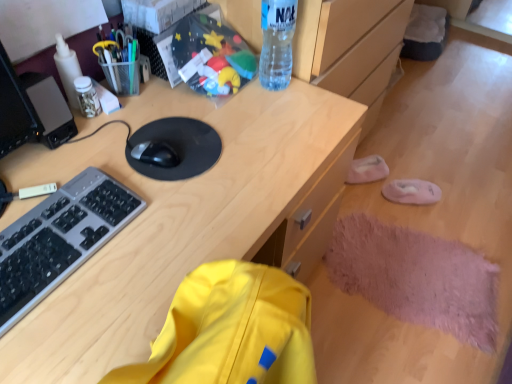
You are a GUI agent. You are given a task and a screenshot of the screen. Output one action in this format:
    pyautogui.click(x=<x>, y=<y>)
    Task: Click on the empty space that is in between black matte mouse at center and gray plastic keyboard at left
    This screenshot has width=512, height=384.
    Given the screenshot: What is the action you would take?
    pyautogui.click(x=133, y=170)